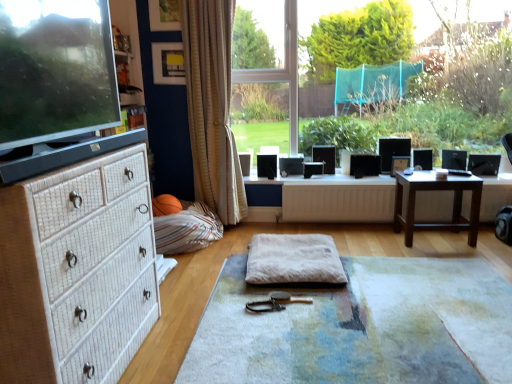
This screenshot has height=384, width=512. In order to click on blank space to the left of white fluffy yoga mat at center, marked as the first yoga mat in a top-to-bottom arrangement in this screenshot , I will do `click(198, 274)`.